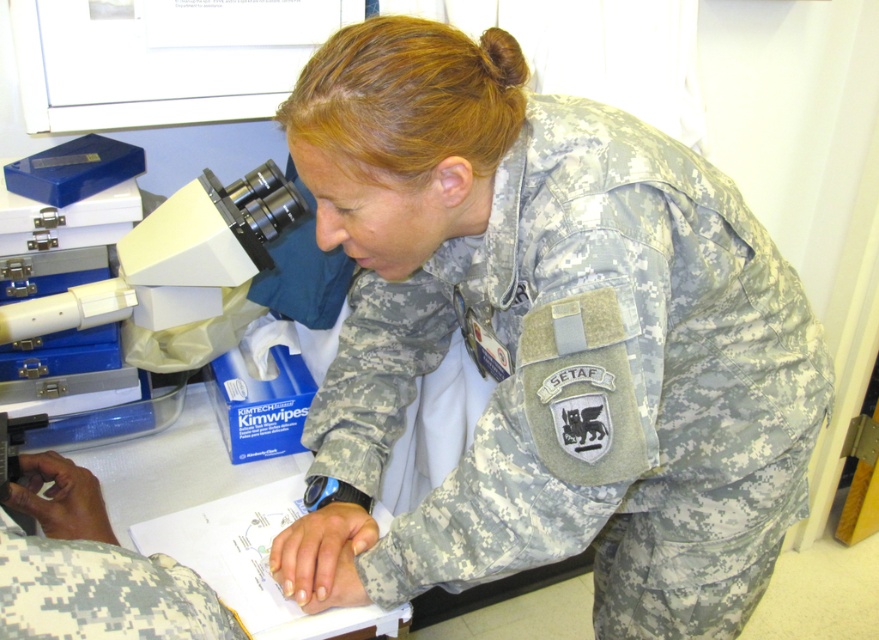
You are an observer in the laboratory. You see the camouflage fabric uniform at center and the white plastic microscope at left. Which object is closer to the front of the scene?

The white plastic microscope at left is closer to the front of the scene because the camouflage fabric uniform at center is positioned under it, indicating it is behind.